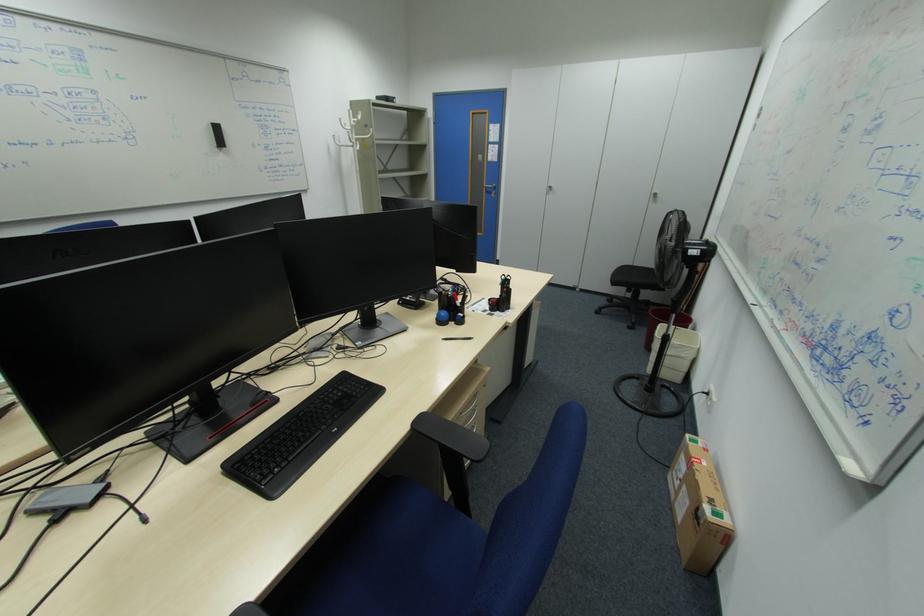
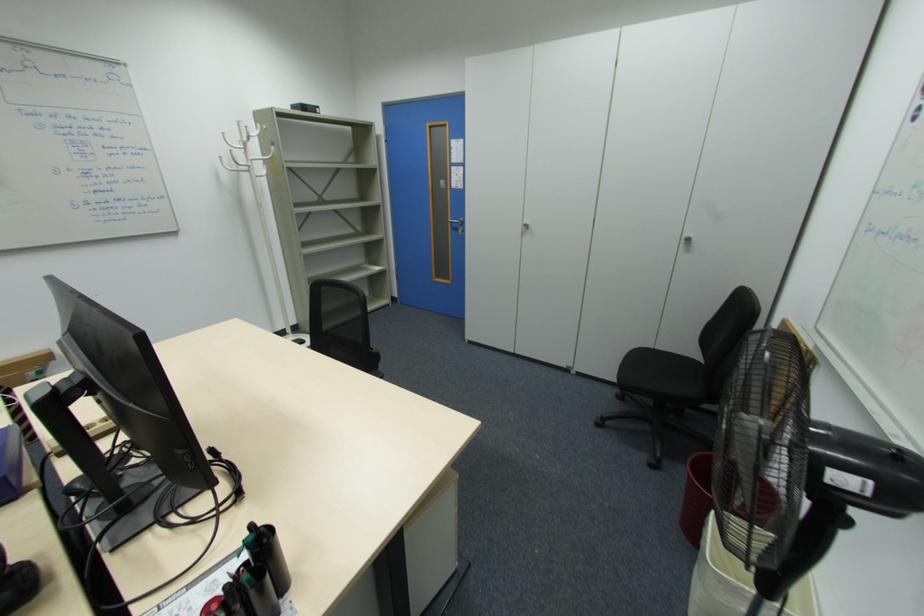
The images are taken continuously from a first-person perspective. In which direction are you moving?

The movement direction of the cameraman is right, forward.